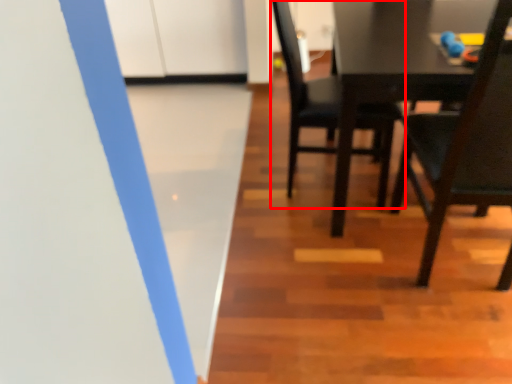
Question: From the image's perspective, what is the correct spatial positioning of chair (annotated by the red box) in reference to chair?

Choices:
 (A) above
 (B) below

Answer: (A)